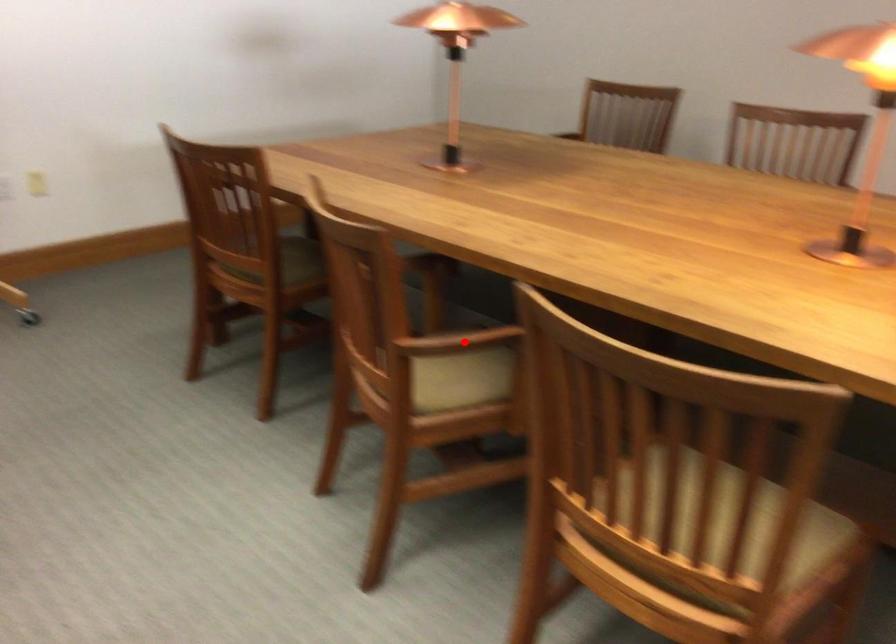
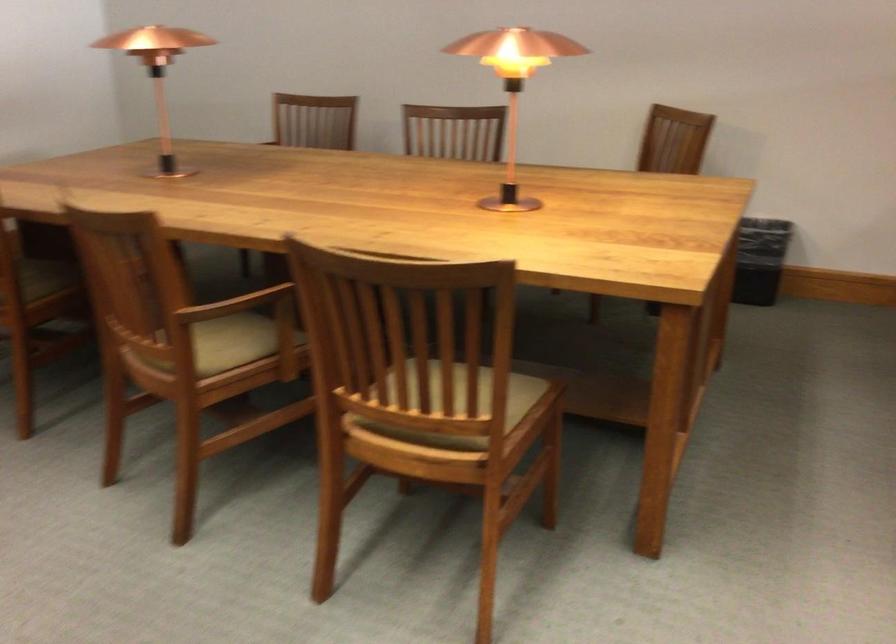
Where in the second image is the point corresponding to the highlighted location from the first image?

(236, 304)